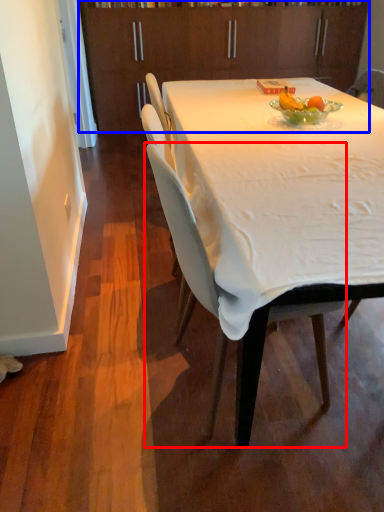
Question: Which of the following is the closest to the observer, chair (highlighted by a red box) or cabinetry (highlighted by a blue box)?

Choices:
 (A) chair
 (B) cabinetry

Answer: (A)